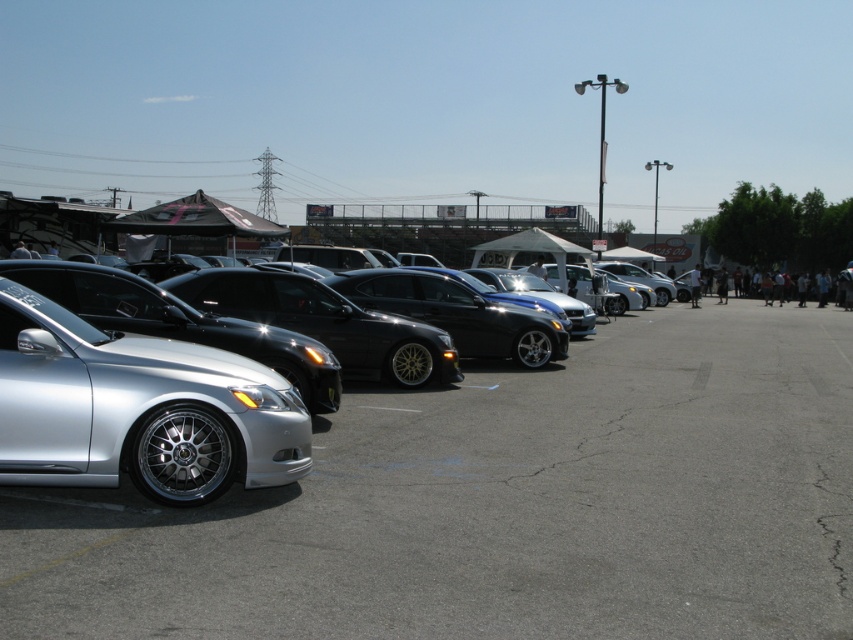
Question: Considering the relative positions of silver polished alloy wheel at left and silver metallic sedan at left in the image provided, where is silver polished alloy wheel at left located with respect to silver metallic sedan at left?

Choices:
 (A) right
 (B) left

Answer: (A)

Question: Does silver polished alloy wheel at left have a greater width compared to silver metallic sedan at left?

Choices:
 (A) yes
 (B) no

Answer: (B)

Question: Among these points, which one is nearest to the camera?

Choices:
 (A) (80, 538)
 (B) (415, 342)

Answer: (A)

Question: Where is silver polished alloy wheel at left located in relation to silver metallic sedan at left in the image?

Choices:
 (A) right
 (B) left

Answer: (A)

Question: Among these points, which one is nearest to the camera?

Choices:
 (A) (389, 472)
 (B) (381, 321)
 (C) (115, 404)

Answer: (C)

Question: Which point is farther to the camera?

Choices:
 (A) silver metallic sedan at left
 (B) silver polished alloy wheel at left
 (C) silver metallic car at left

Answer: (A)